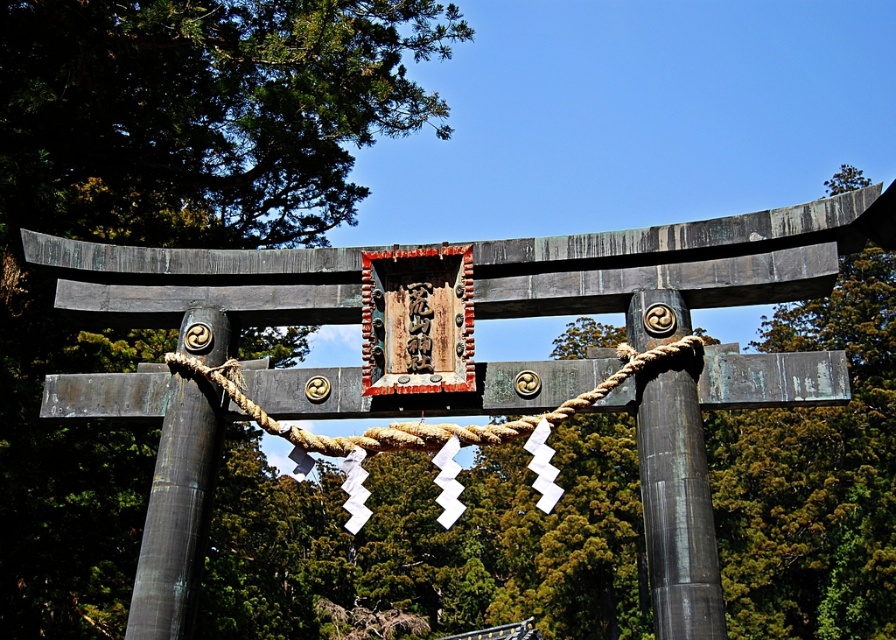
Does point (655, 467) come in front of point (214, 336)?

Yes, point (655, 467) is closer to viewer.

Between smooth dark wood post at center and bronze textured pole at center, which one is positioned lower?

bronze textured pole at center

What are the coordinates of `smooth dark wood post at center` in the screenshot? It's located at (677, 500).

Identify the location of smooth dark wood post at center. (677, 500).

Does smooth dark wood post at center have a larger size compared to rope at center?

No, smooth dark wood post at center is not bigger than rope at center.

Is smooth dark wood post at center taller than rope at center?

Yes, smooth dark wood post at center is taller than rope at center.

Find the location of a particular element. The width and height of the screenshot is (896, 640). smooth dark wood post at center is located at coordinates (677, 500).

Does point (157, 458) come farther from viewer compared to point (638, 362)?

Yes, point (157, 458) is farther from viewer.

How far apart are bronze textured pole at center and rope at center?

bronze textured pole at center and rope at center are 4.25 meters apart from each other.

Is point (202, 308) positioned after point (349, 436)?

Yes, it is.

Find the location of `bronze textured pole at center`. bronze textured pole at center is located at coordinates (177, 512).